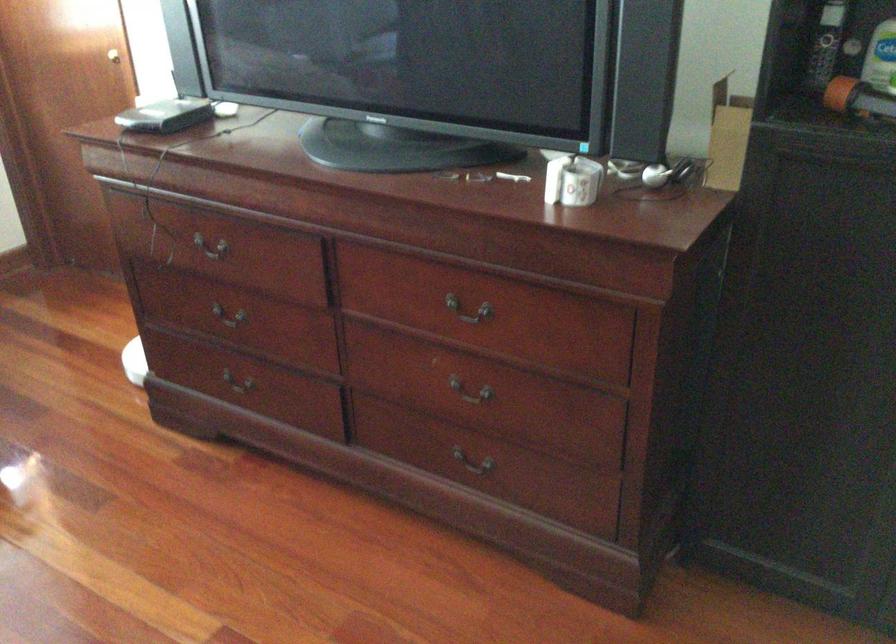
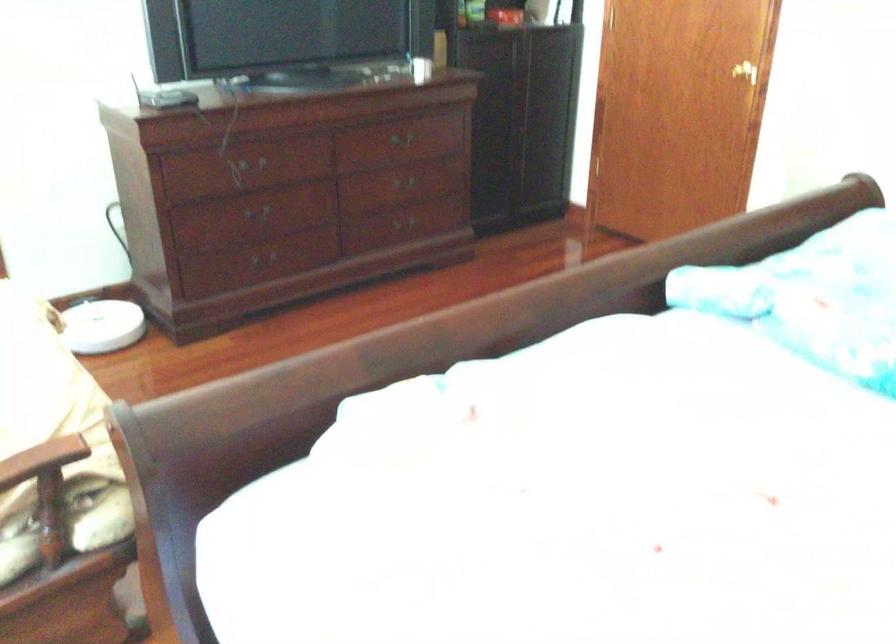
Find the pixel in the second image that matches the point at 237,260 in the first image.

(255, 164)